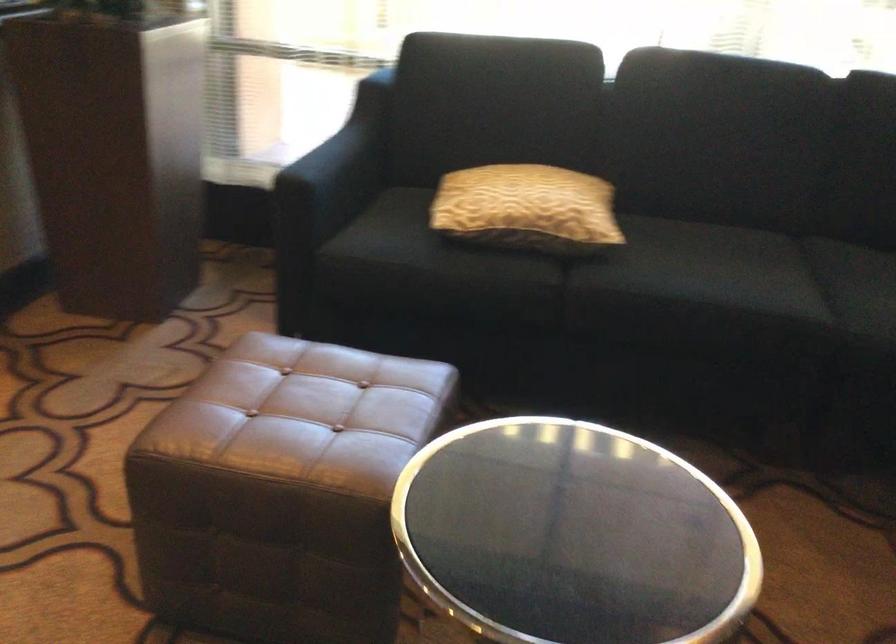
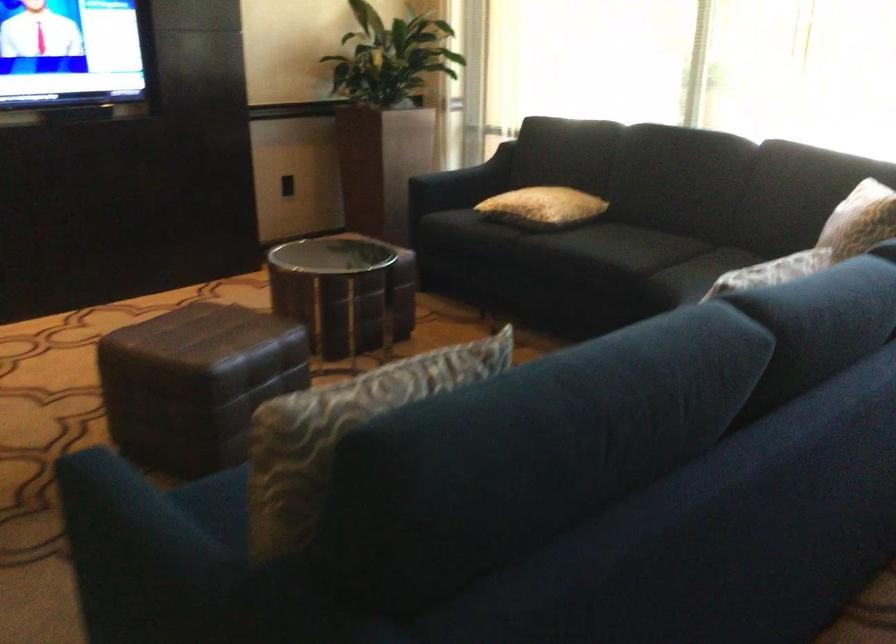
Locate, in the second image, the point that corresponds to the point at 351,178 in the first image.

(460, 184)